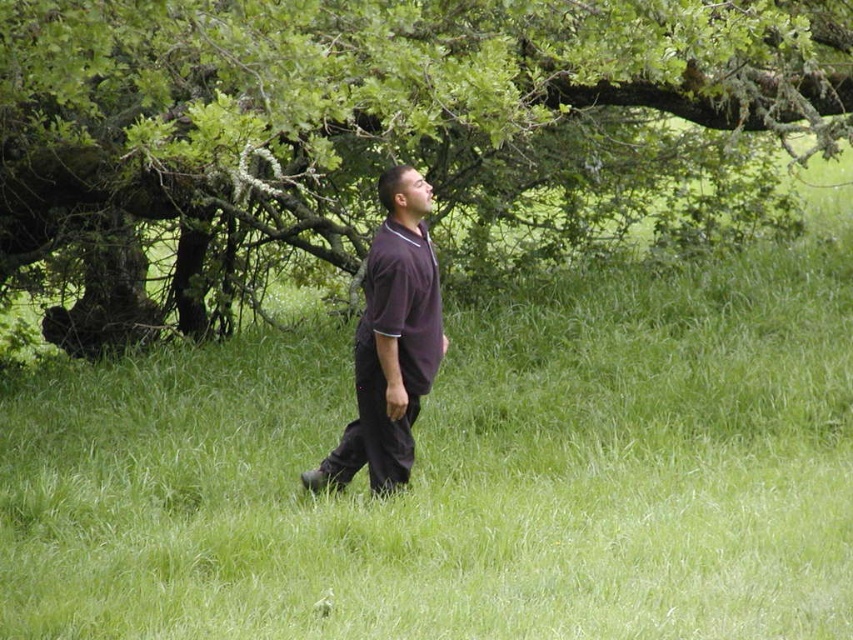
Is green leafy tree at upper center above purple smooth shirt at center?

Correct, green leafy tree at upper center is located above purple smooth shirt at center.

Is green leafy tree at upper center positioned before purple smooth shirt at center?

That is True.

Image resolution: width=853 pixels, height=640 pixels. I want to click on green leafy tree at upper center, so click(386, 138).